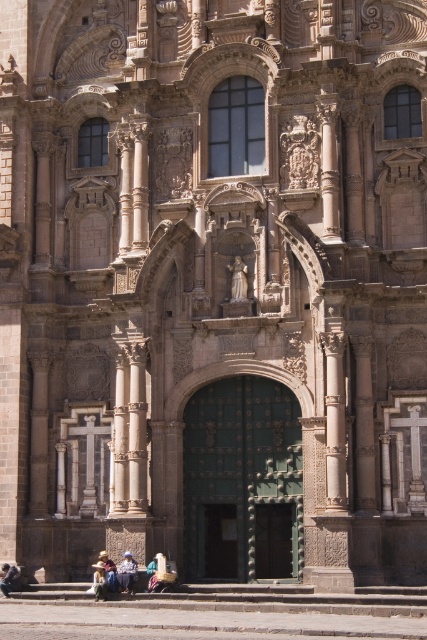
Which of these two, matte stone statue at center or light brown woven hat at lower center, stands taller?

matte stone statue at center is taller.

Does matte stone statue at center have a lesser height compared to light brown woven hat at lower center?

No.

Does point (245, 298) lie behind point (116, 573)?

Yes, it is.

What are the coordinates of `matte stone statue at center` in the screenshot? It's located at click(x=237, y=280).

Between matte stone statue at center and light brown leather jacket at lower center, which one has more height?

matte stone statue at center is taller.

Does matte stone statue at center appear on the right side of light brown leather jacket at lower center?

Indeed, matte stone statue at center is positioned on the right side of light brown leather jacket at lower center.

What do you see at coordinates (237, 280) in the screenshot? The height and width of the screenshot is (640, 427). I see `matte stone statue at center` at bounding box center [237, 280].

Locate an element on the screen. Image resolution: width=427 pixels, height=640 pixels. matte stone statue at center is located at coordinates (237, 280).

Can you confirm if stone steps at center is positioned above light brown leather jacket at lower center?

Incorrect, stone steps at center is not positioned above light brown leather jacket at lower center.

Which is behind, point (259, 586) or point (114, 570)?

Positioned behind is point (259, 586).

Is point (423, 596) positioned behind point (105, 556)?

No, it is in front of (105, 556).

Identify the location of stone steps at center. The image size is (427, 640). (280, 600).